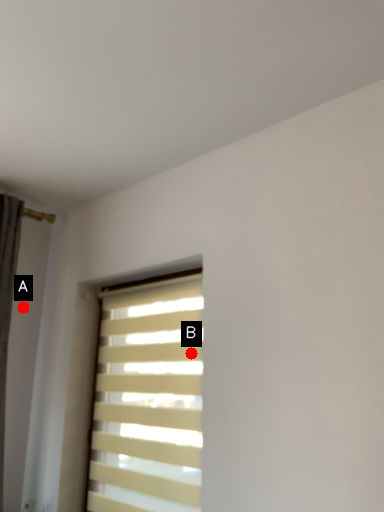
Question: Two points are circled on the image, labeled by A and B beside each circle. Which point is farther from the camera taking this photo?

Choices:
 (A) A is further
 (B) B is further

Answer: (A)